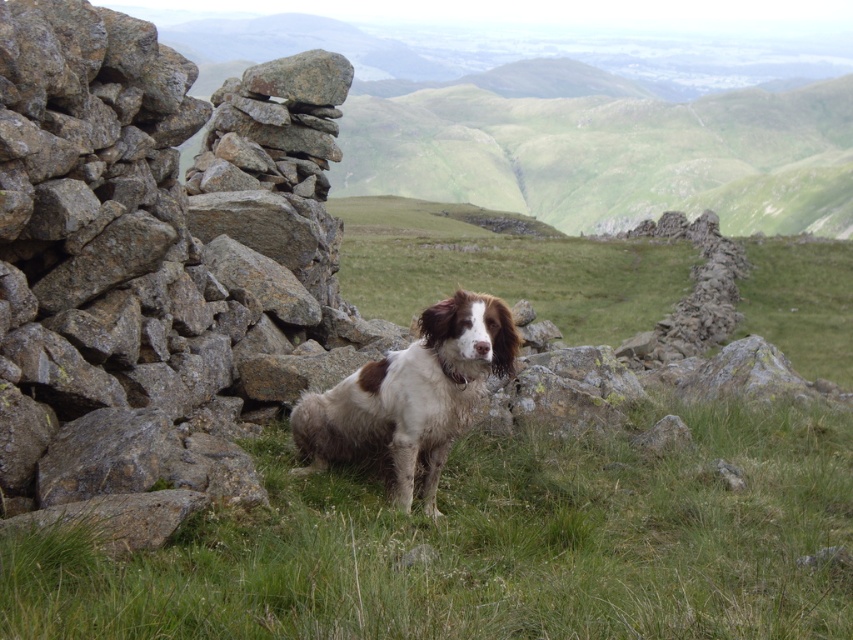
Question: Does rough gray rock at left appear on the left side of brown and white fur dog at center?

Choices:
 (A) no
 (B) yes

Answer: (B)

Question: Is rough gray rock at left behind brown and white fur dog at center?

Choices:
 (A) no
 (B) yes

Answer: (A)

Question: Is rough gray rock at left positioned at the back of brown and white fur dog at center?

Choices:
 (A) yes
 (B) no

Answer: (B)

Question: Among these objects, which one is nearest to the camera?

Choices:
 (A) rough gray rock at left
 (B) brown and white fur dog at center

Answer: (A)